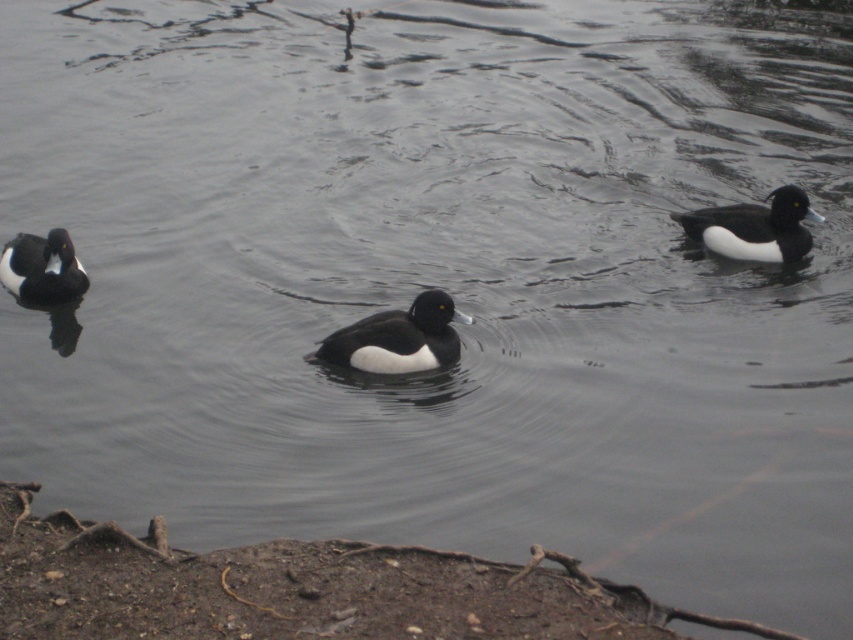
Does white matte duck at right have a smaller size compared to white-feathered duck at left?

No, white matte duck at right is not smaller than white-feathered duck at left.

Is white matte duck at right wider than white-feathered duck at left?

Yes, white matte duck at right is wider than white-feathered duck at left.

Who is more forward, (793, 225) or (41, 237)?

Positioned in front is point (41, 237).

Find the location of a particular element. This screenshot has height=640, width=853. white matte duck at right is located at coordinates (753, 227).

Which is behind, point (386, 372) or point (77, 273)?

The point (77, 273) is behind.

From the picture: Is black glossy duck at center closer to camera compared to white-feathered duck at left?

Yes, it is in front of white-feathered duck at left.

You are a GUI agent. You are given a task and a screenshot of the screen. Output one action in this format:
    pyautogui.click(x=<x>, y=<y>)
    Task: Click on the black glossy duck at center
    
    Given the screenshot: What is the action you would take?
    pyautogui.click(x=397, y=339)

Which of these two, black glossy duck at center or white matte duck at right, stands shorter?

black glossy duck at center

Where is `black glossy duck at center`? This screenshot has width=853, height=640. black glossy duck at center is located at coordinates (397, 339).

The width and height of the screenshot is (853, 640). What do you see at coordinates (397, 339) in the screenshot?
I see `black glossy duck at center` at bounding box center [397, 339].

Where is `black glossy duck at center`? The image size is (853, 640). black glossy duck at center is located at coordinates (397, 339).